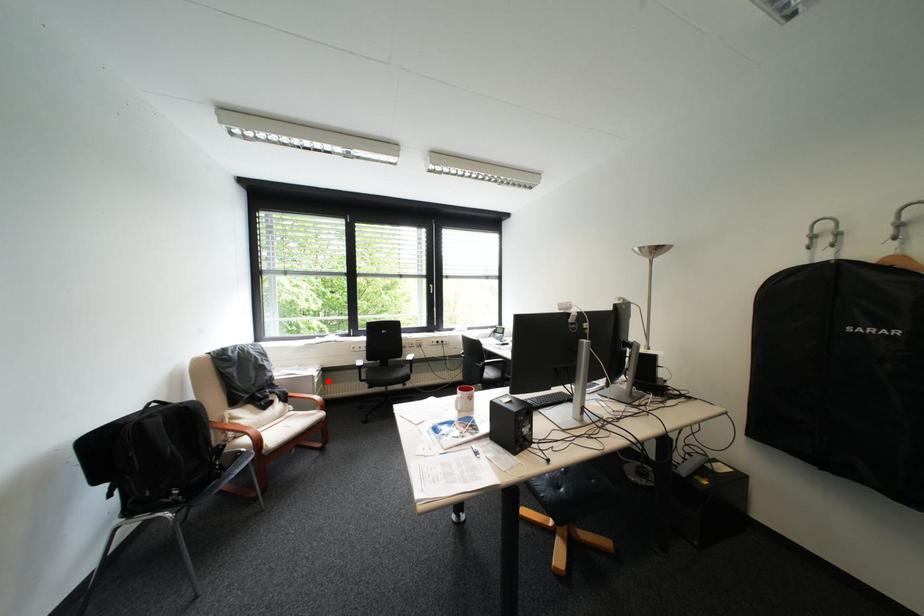
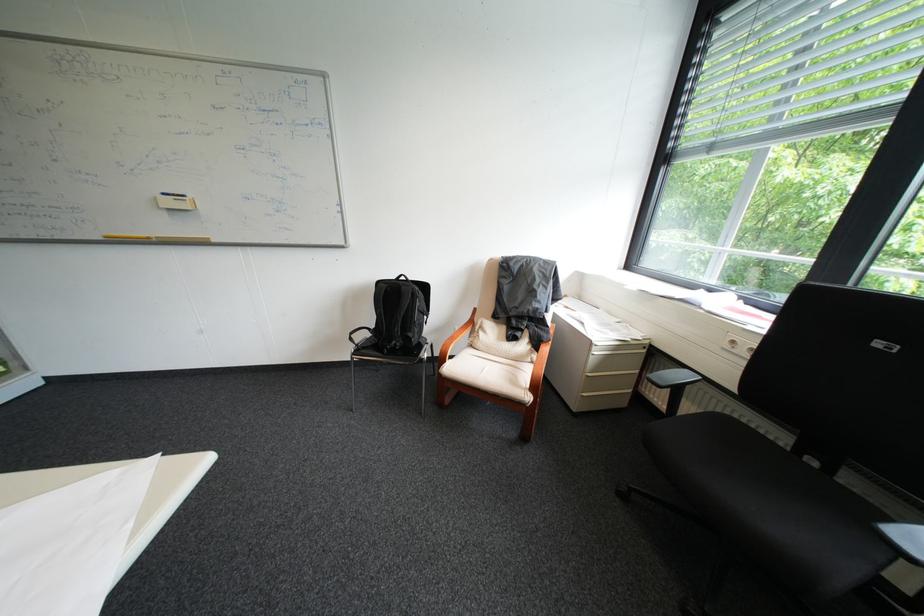
Question: I am providing you with two images of the same scene from different viewpoints. A red point is marked on the first image. Is the red point's position out of view in image 2?

Choices:
 (A) Yes
 (B) No

Answer: (B)